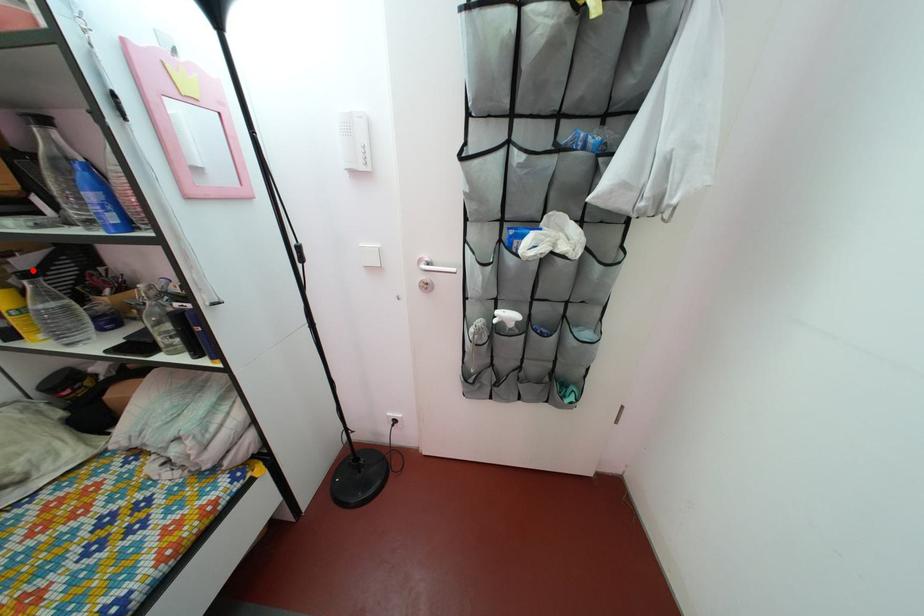
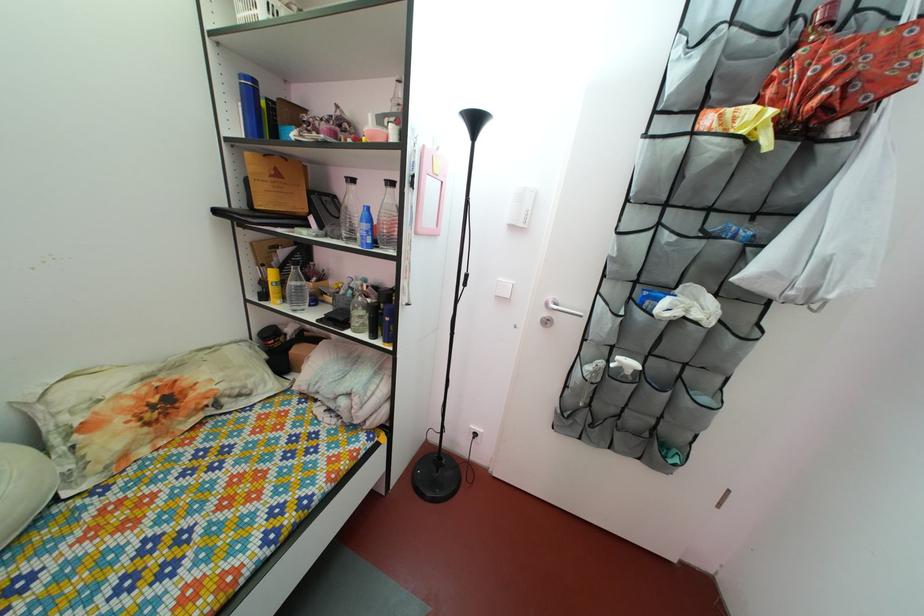
Locate, in the second image, the point that corresponds to the highlighted location in the first image.

(292, 262)